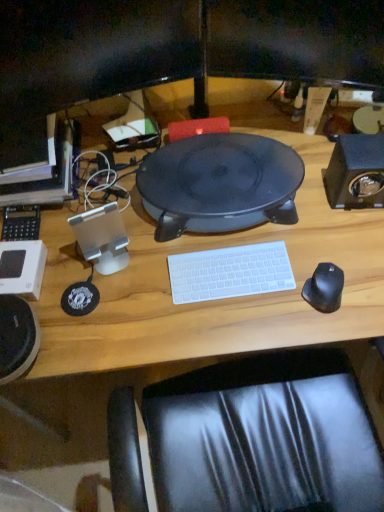
Question: Is black matte speaker at right taller than black matte mouse at right?

Choices:
 (A) yes
 (B) no

Answer: (A)

Question: Considering the relative sizes of black matte speaker at right and black matte mouse at right in the image provided, is black matte speaker at right thinner than black matte mouse at right?

Choices:
 (A) yes
 (B) no

Answer: (B)

Question: Is black matte speaker at right positioned far away from black matte mouse at right?

Choices:
 (A) no
 (B) yes

Answer: (A)

Question: Can black matte mouse at right be found inside black matte speaker at right?

Choices:
 (A) yes
 (B) no

Answer: (B)

Question: From the image's perspective, is black matte speaker at right above black matte mouse at right?

Choices:
 (A) yes
 (B) no

Answer: (A)

Question: Is black matte speaker at right outside black matte mouse at right?

Choices:
 (A) yes
 (B) no

Answer: (A)

Question: Is matte black monitor at left completely or partially outside of black matte speaker at center?

Choices:
 (A) no
 (B) yes

Answer: (B)

Question: Is matte black monitor at left facing away from black matte speaker at center?

Choices:
 (A) no
 (B) yes

Answer: (A)

Question: Does matte black monitor at left turn towards black matte speaker at center?

Choices:
 (A) no
 (B) yes

Answer: (A)

Question: From a real-world perspective, is matte black monitor at left located higher than black matte speaker at center?

Choices:
 (A) no
 (B) yes

Answer: (B)

Question: Does matte black monitor at left appear on the left side of black matte speaker at center?

Choices:
 (A) no
 (B) yes

Answer: (B)

Question: Does matte black monitor at left have a lesser width compared to black matte speaker at center?

Choices:
 (A) yes
 (B) no

Answer: (B)

Question: Are black matte speaker at center and matte black monitor at left located far from each other?

Choices:
 (A) no
 (B) yes

Answer: (A)